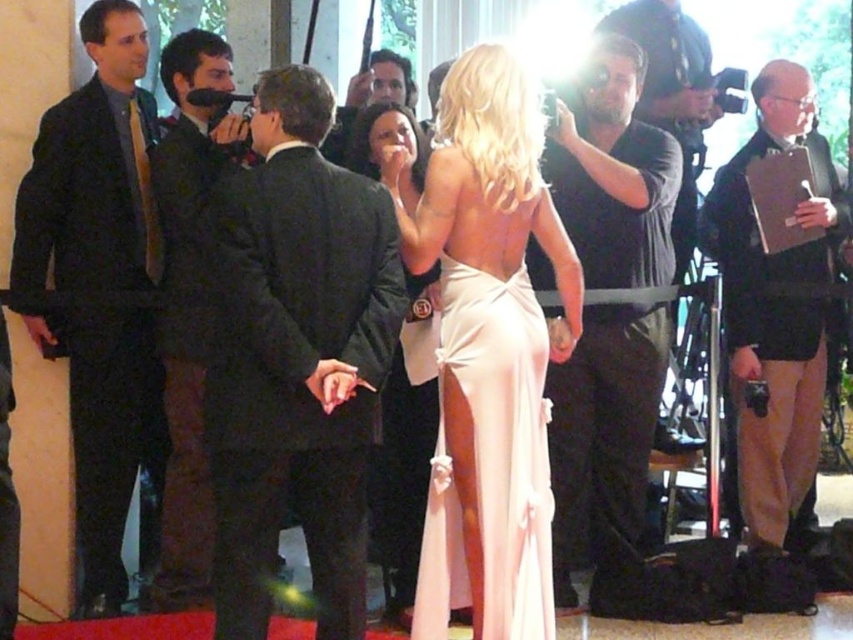
Question: Which object is closer to the camera taking this photo?

Choices:
 (A) satin beige dress at center
 (B) matte black suit at left
 (C) dark suit at left
 (D) satin pale pink dress at center

Answer: (D)

Question: Considering the real-world distances, which object is closest to the satin pale pink dress at center?

Choices:
 (A) dark gray shirt at center
 (B) black suit at center
 (C) satin beige dress at center

Answer: (B)

Question: Which point appears farthest from the camera in this image?

Choices:
 (A) (207, 154)
 (B) (801, 516)

Answer: (B)

Question: Can you confirm if matte black camera at right is positioned to the right of dark gray shirt at center?

Choices:
 (A) yes
 (B) no

Answer: (B)

Question: Can you confirm if matte black camera at right is positioned below satin beige dress at center?

Choices:
 (A) no
 (B) yes

Answer: (A)

Question: Can you confirm if black suit at center is positioned to the right of satin pink dress at center?

Choices:
 (A) yes
 (B) no

Answer: (B)